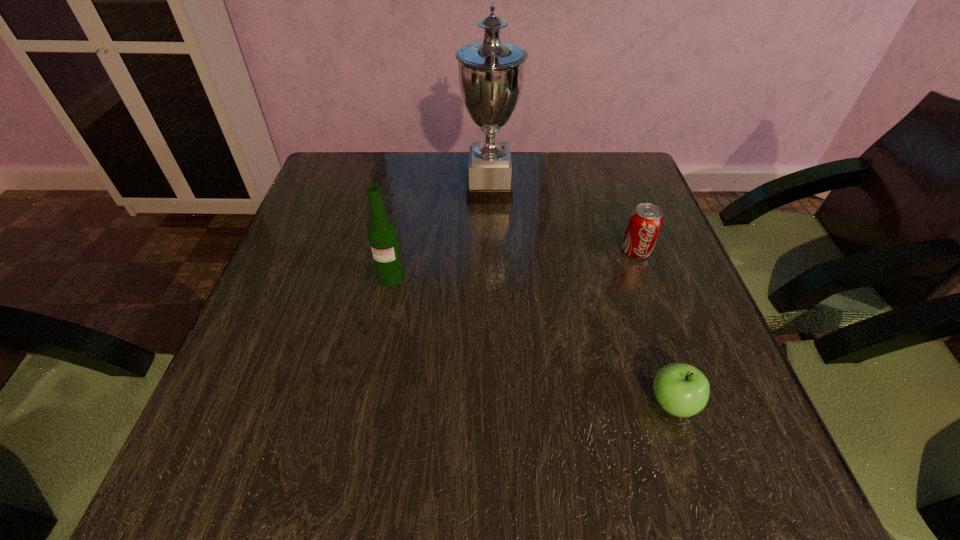
Where is `free space that is in between the second farthest object and the beer bottle`? Image resolution: width=960 pixels, height=540 pixels. free space that is in between the second farthest object and the beer bottle is located at coordinates (514, 264).

The width and height of the screenshot is (960, 540). What are the coordinates of `vacant area between the apple and the second shortest object` in the screenshot? It's located at (654, 327).

Locate which object ranks in proximity to the third tallest object. Please provide its 2D coordinates. Your answer should be formatted as a tuple, i.e. [(x, y)], where the tuple contains the x and y coordinates of a point satisfying the conditions above.

[(491, 73)]

Identify which object is the third closest to the second shortest object. Please provide its 2D coordinates. Your answer should be formatted as a tuple, i.e. [(x, y)], where the tuple contains the x and y coordinates of a point satisfying the conditions above.

[(382, 234)]

This screenshot has width=960, height=540. I want to click on vacant space that satisfies the following two spatial constraints: 1. on the label of the nearest object; 2. on the left side of the second nearest object, so click(x=367, y=403).

In order to click on vacant position in the image that satisfies the following two spatial constraints: 1. on the label of the apple; 2. on the right side of the beer bottle in this screenshot , I will do `click(367, 403)`.

This screenshot has height=540, width=960. I want to click on vacant region that satisfies the following two spatial constraints: 1. on the label of the leftmost object; 2. on the left side of the apple, so click(x=367, y=403).

Find the location of a particular element. free space that satisfies the following two spatial constraints: 1. at the front view of the apple; 2. on the right side of the second object from left to right is located at coordinates (494, 403).

The height and width of the screenshot is (540, 960). Identify the location of free space that satisfies the following two spatial constraints: 1. at the front view of the farthest object; 2. on the left side of the nearest object. (494, 403).

Where is `vacant space that satisfies the following two spatial constraints: 1. at the front view of the tallest object; 2. on the label of the beer bottle`? This screenshot has height=540, width=960. vacant space that satisfies the following two spatial constraints: 1. at the front view of the tallest object; 2. on the label of the beer bottle is located at coordinates (492, 278).